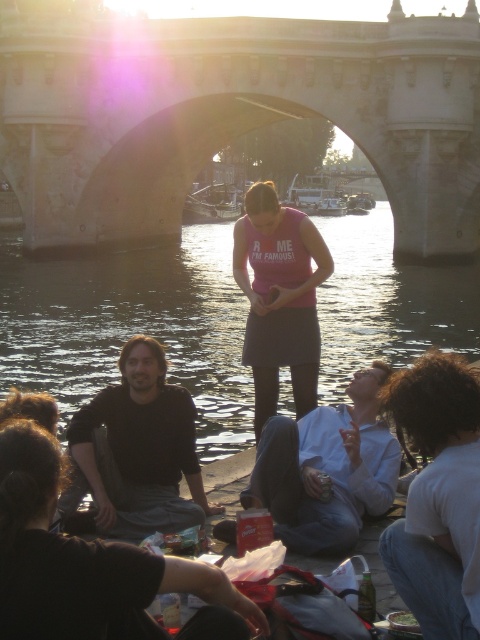
Question: Can you confirm if dark water at center is positioned to the right of pink matte skirt at center?

Choices:
 (A) yes
 (B) no

Answer: (A)

Question: Which of the following is the closest to the observer?

Choices:
 (A) (14, 260)
 (B) (295, 276)
 (C) (166, 45)

Answer: (B)

Question: Based on their relative distances, which object is farther from the dark water at center?

Choices:
 (A) stone bridge at center
 (B) pink matte skirt at center

Answer: (B)

Question: Among these points, which one is nearest to the camera?

Choices:
 (A) (265, 236)
 (B) (120, 122)
 (C) (227, 369)

Answer: (A)

Question: Can you confirm if stone bridge at center is positioned below dark water at center?

Choices:
 (A) yes
 (B) no

Answer: (B)

Question: Does dark water at center appear under pink matte skirt at center?

Choices:
 (A) yes
 (B) no

Answer: (B)